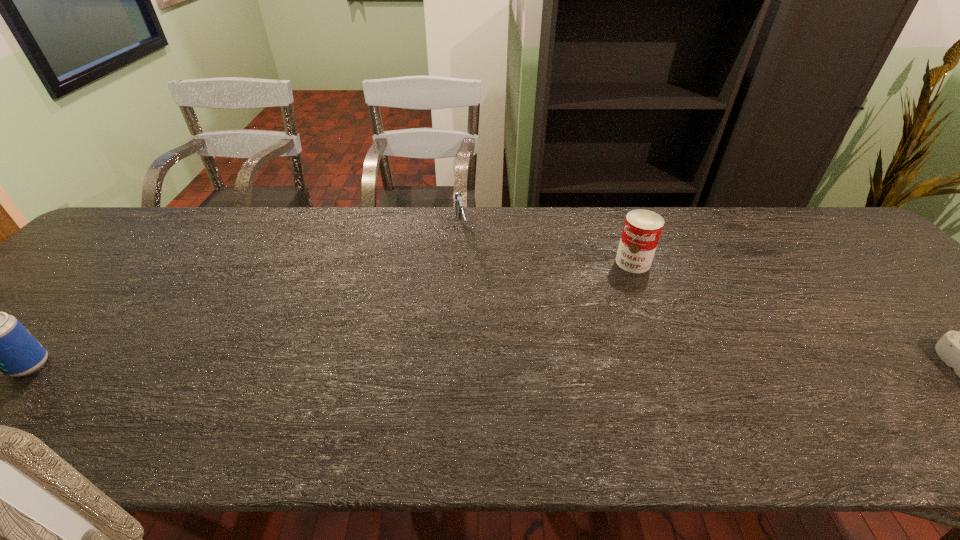
Find the location of a particular element. This screenshot has height=540, width=960. gun at the far edge is located at coordinates (459, 208).

Image resolution: width=960 pixels, height=540 pixels. I want to click on can that is at the far edge, so 642,228.

Identify the location of free spot at the far edge of the desktop. tap(396, 207).

Find the location of `vacant space at the near edge of the desktop`. vacant space at the near edge of the desktop is located at coordinates 561,395.

The height and width of the screenshot is (540, 960). In the image, there is a desktop. In order to click on vacant region at the left edge in this screenshot , I will do `click(119, 258)`.

Where is `vacant space at the right edge of the desktop`? This screenshot has height=540, width=960. vacant space at the right edge of the desktop is located at coordinates (912, 287).

This screenshot has width=960, height=540. I want to click on the closest object to the shortest object, so click(x=642, y=228).

Locate an element on the screen. object that ranks as the closest to the second object from left to right is located at coordinates point(642,228).

The width and height of the screenshot is (960, 540). I want to click on free space that satisfies the following two spatial constraints: 1. on the front side of the farthest object; 2. on the left side of the can, so click(x=459, y=262).